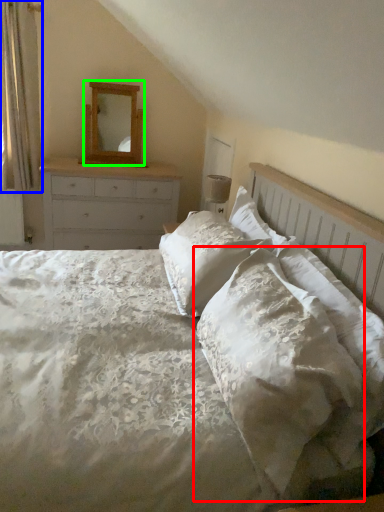
Question: Which is farther away from pillow (highlighted by a red box)? curtain (highlighted by a blue box) or mirror (highlighted by a green box)?

Choices:
 (A) curtain
 (B) mirror

Answer: (A)